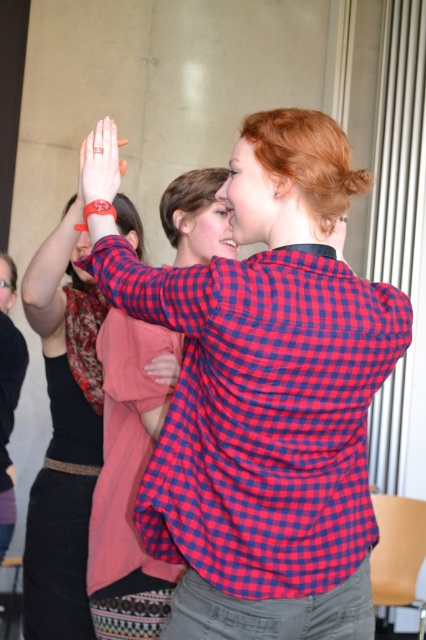
You are a photographer analyzing the composition of this image. The scene shows two people about to high five. You need to place a sticker exactly where the matte red wristband at upper left is located. What coordinates should you use?

The coordinates for the matte red wristband at upper left are at point (101,161).

You are at the center of the room and see the red checkered shirt at center. Can you walk directly towards it?

Yes, you can walk directly towards the red checkered shirt at center since it is located at point (265,397), which is in the center of the room.